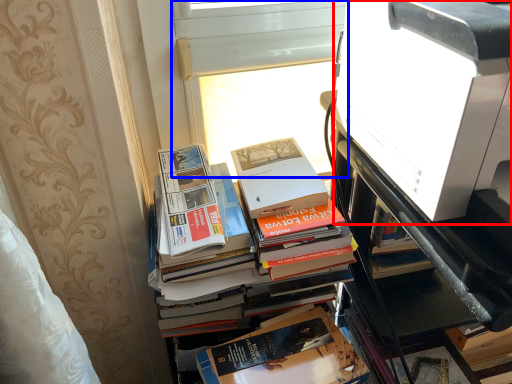
Question: Which of the following is the farthest to the observer, printer (highlighted by a red box) or window screen (highlighted by a blue box)?

Choices:
 (A) printer
 (B) window screen

Answer: (B)